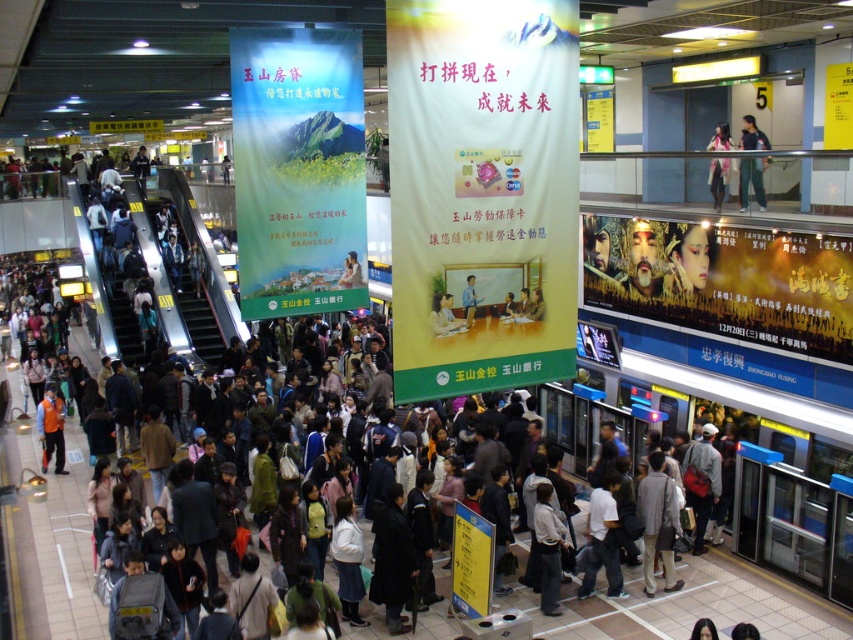
Between green matte banner at center and white cotton shirt at center, which one appears on the right side from the viewer's perspective?

white cotton shirt at center is more to the right.

This screenshot has height=640, width=853. I want to click on green matte banner at center, so click(482, 192).

Locate an element on the screen. The width and height of the screenshot is (853, 640). green matte banner at center is located at coordinates (482, 192).

Can you confirm if matte black poster at right is taller than pink fabric at upper center?

No.

Which is behind, point (689, 244) or point (728, 177)?

The point (689, 244) is more distant.

Does point (668, 298) come in front of point (717, 138)?

Yes, it is in front of point (717, 138).

The width and height of the screenshot is (853, 640). Find the location of `matte black poster at right`. matte black poster at right is located at coordinates (724, 280).

Is point (194, 346) positioned before point (718, 161)?

No.

Where is `metallic silver escalator at left`? The width and height of the screenshot is (853, 640). metallic silver escalator at left is located at coordinates (199, 276).